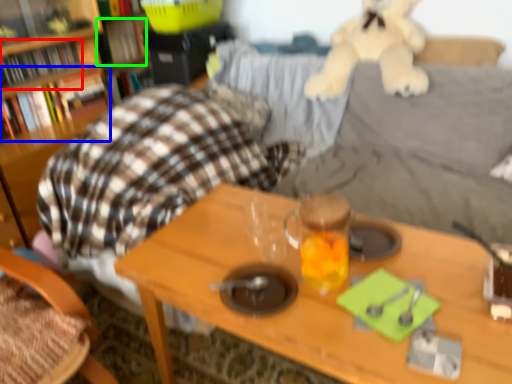
Question: Estimate the real-world distances between objects in this image. Which object is farther from book (highlighted by a red box), book (highlighted by a blue box) or book (highlighted by a green box)?

Choices:
 (A) book
 (B) book

Answer: (B)